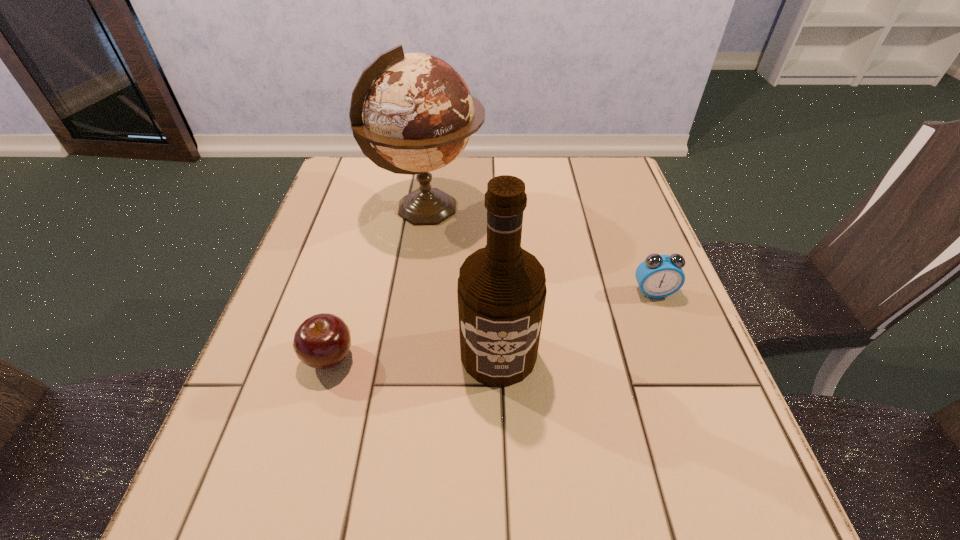
Where is `free area in between the alarm clock and the alcohol`? Image resolution: width=960 pixels, height=540 pixels. free area in between the alarm clock and the alcohol is located at coordinates (576, 323).

Where is `free space that is in between the third nearest object and the farthest object`? free space that is in between the third nearest object and the farthest object is located at coordinates (540, 251).

Locate an element on the screen. vacant space that's between the apple and the alcohol is located at coordinates (414, 355).

Identify the location of empty space that is in between the globe and the apple. (378, 283).

You are a GUI agent. You are given a task and a screenshot of the screen. Output one action in this format:
    pyautogui.click(x=<x>, y=<y>)
    Task: Click on the blank region between the apple and the alcohol
    
    Given the screenshot: What is the action you would take?
    pyautogui.click(x=414, y=355)

Where is `the closest object to the globe`? the closest object to the globe is located at coordinates (501, 290).

Identify which object is located as the third nearest to the farthest object. Please provide its 2D coordinates. Your answer should be formatted as a tuple, i.e. [(x, y)], where the tuple contains the x and y coordinates of a point satisfying the conditions above.

[(658, 276)]